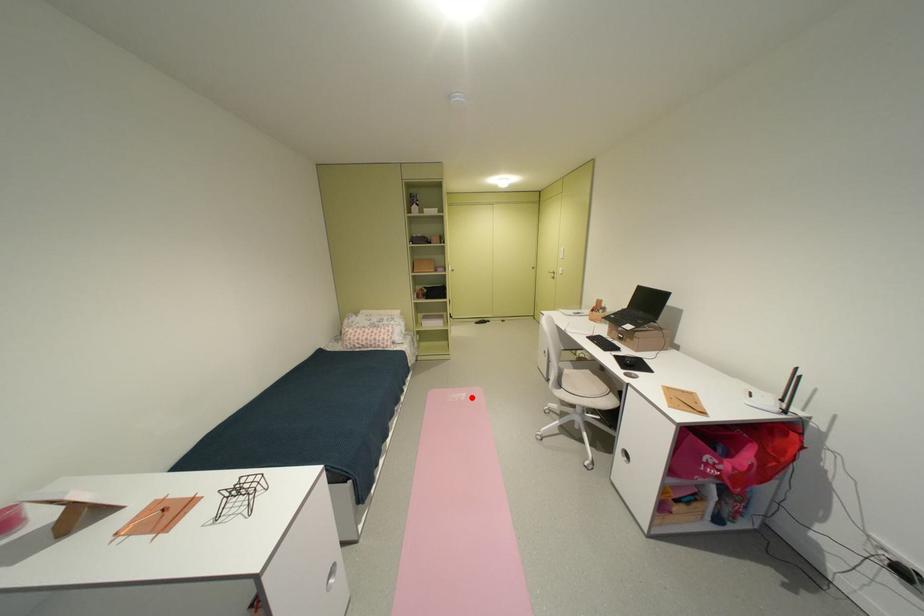
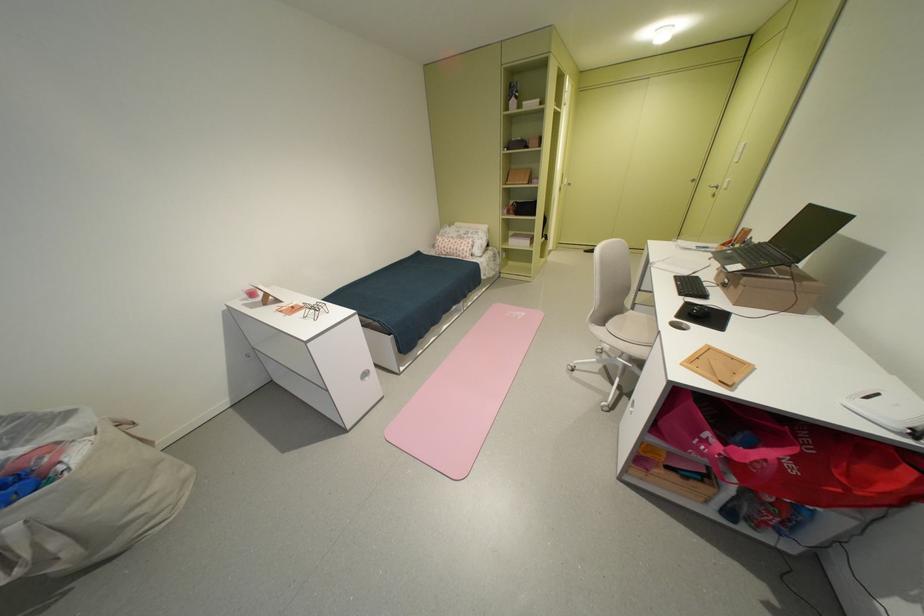
Locate, in the second image, the point that corresponds to the highlighted location in the first image.

(530, 315)